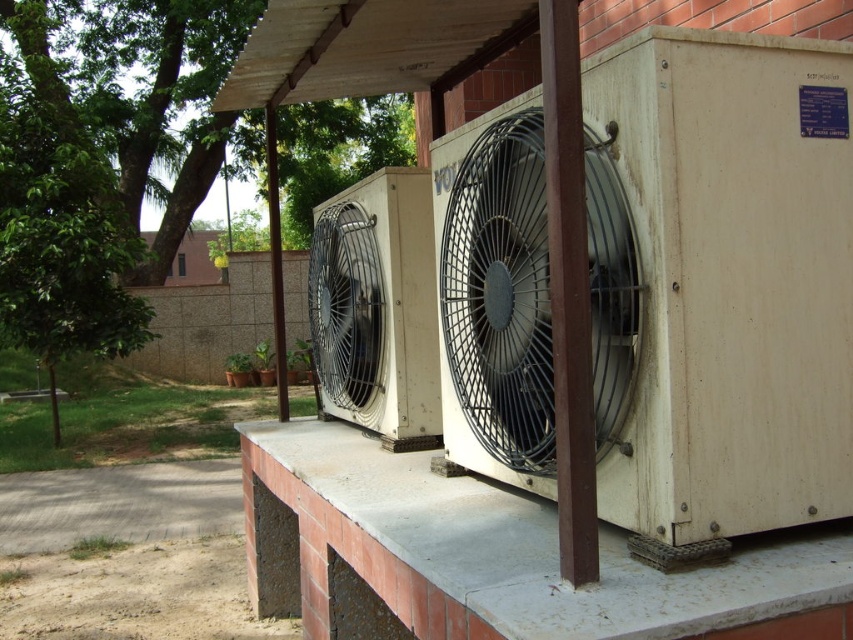
Question: Does white concrete ledge at center lie in front of metallic gray fan at center?

Choices:
 (A) yes
 (B) no

Answer: (A)

Question: Which point is closer to the camera?

Choices:
 (A) (453, 282)
 (B) (747, 550)

Answer: (B)

Question: Is white concrete ledge at center behind metallic gray fan at center?

Choices:
 (A) yes
 (B) no

Answer: (B)

Question: Is white concrete ledge at center positioned before metallic gray fan at center?

Choices:
 (A) no
 (B) yes

Answer: (B)